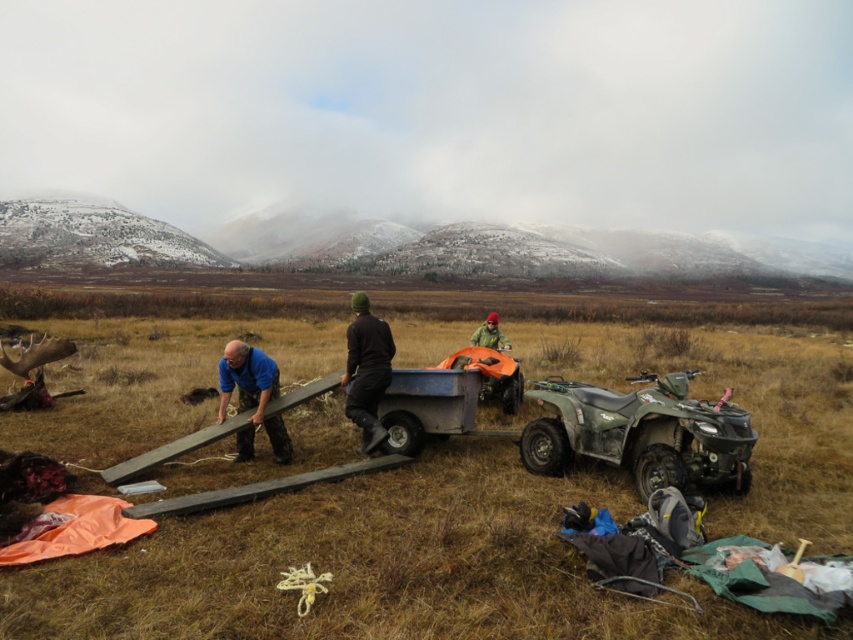
Question: Can you confirm if wooden plank at center is bigger than green matte jacket at center?

Choices:
 (A) yes
 (B) no

Answer: (A)

Question: Which of the following is the closest to the observer?

Choices:
 (A) (379, 422)
 (B) (224, 387)

Answer: (B)

Question: Does wooden plank at center appear over black matte jacket at center?

Choices:
 (A) no
 (B) yes

Answer: (A)

Question: Which point is closer to the camera taking this photo?

Choices:
 (A) (241, 344)
 (B) (363, 435)
 (C) (494, 333)

Answer: (A)

Question: Is black matte jacket at center smaller than blue fabric shirt at left?

Choices:
 (A) yes
 (B) no

Answer: (A)

Question: Among these objects, which one is farthest from the camera?

Choices:
 (A) green matte jacket at center
 (B) wooden plank at center
 (C) blue fabric shirt at left
 (D) black matte jacket at center

Answer: (A)